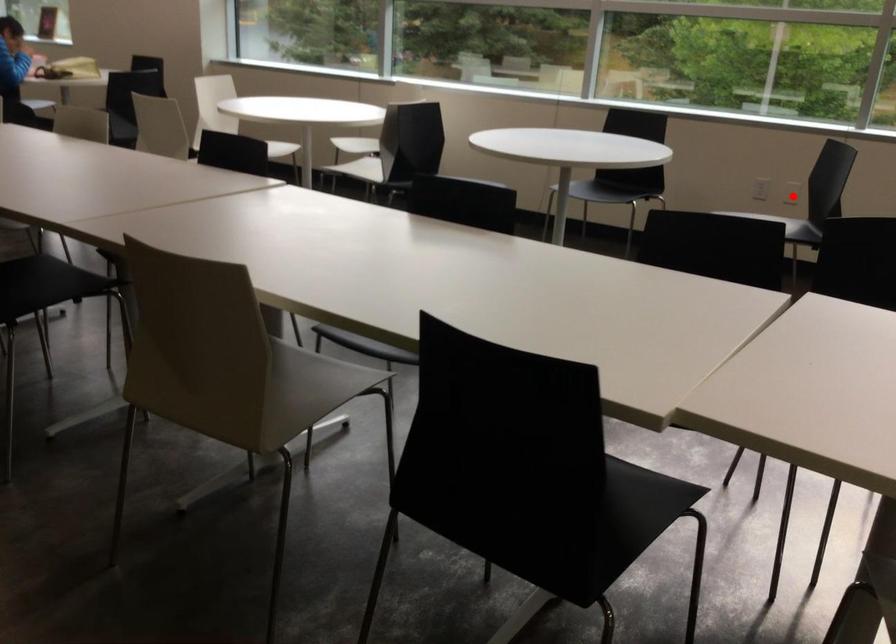
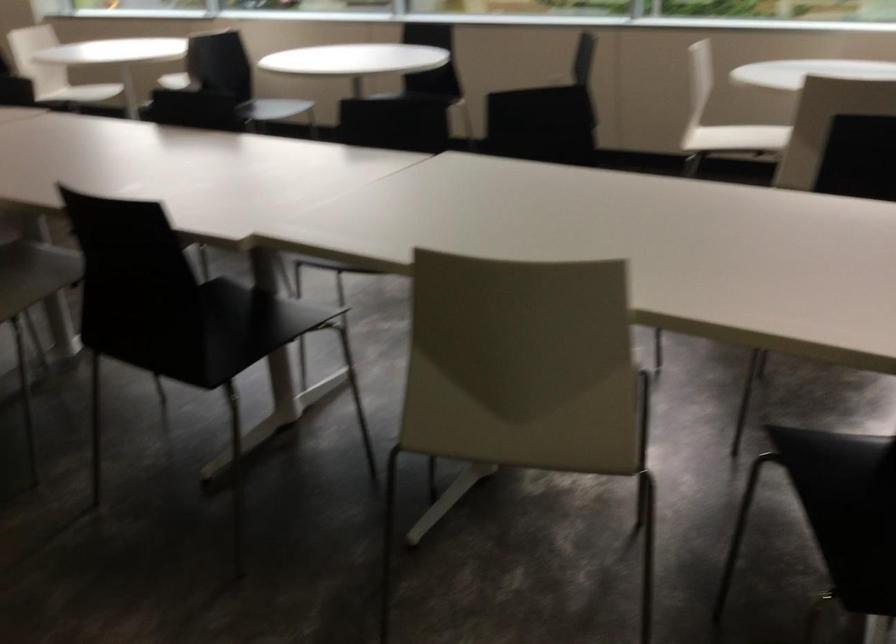
Question: I am providing you with two images of the same scene from different viewpoints. A red point is marked on the first image. Can you still see the location of the red point in image 2?

Choices:
 (A) Yes
 (B) No

Answer: (B)